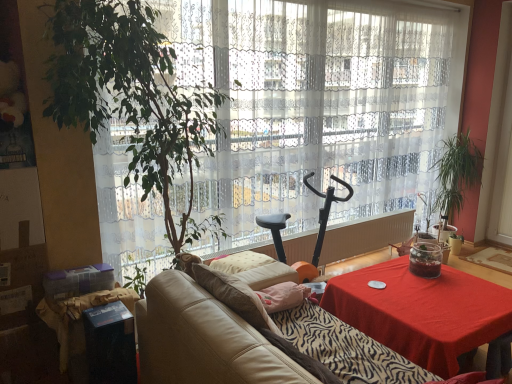
At what (x,y) coordinates should I click in order to perform the action: click on free location to the right of translucent glass jar at center. Please return your answer as a coordinate pair (x, y). The image size is (512, 384). Looking at the image, I should click on (458, 276).